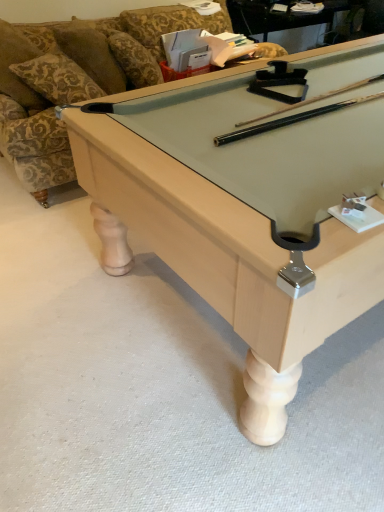
Describe the element at coordinates (247, 206) in the screenshot. I see `natural wood pool table at center` at that location.

Identify the location of natural wood pool table at center. (247, 206).

Find the location of a particular element. The width and height of the screenshot is (384, 512). natural wood pool table at center is located at coordinates (247, 206).